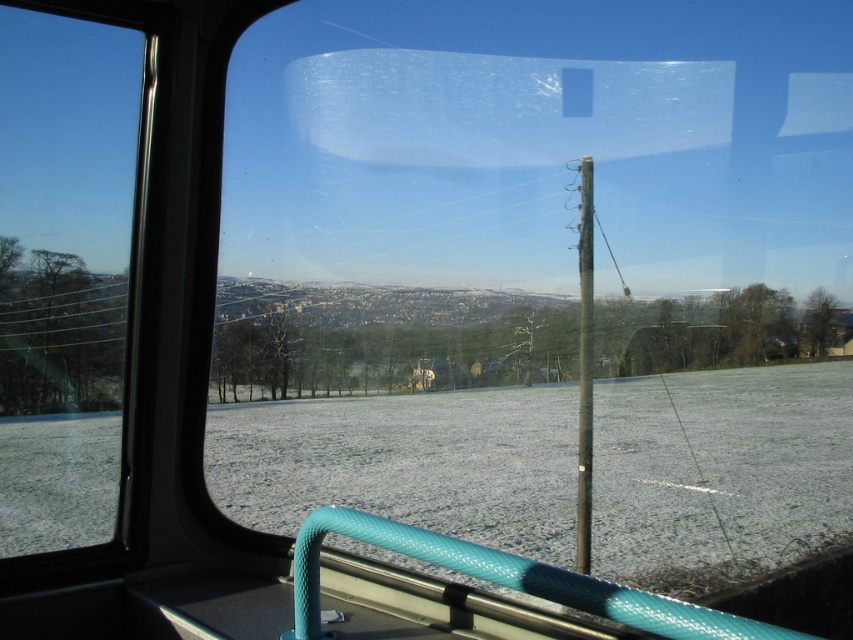
Question: Is transparent glass window at left below metallic pole at center?

Choices:
 (A) yes
 (B) no

Answer: (B)

Question: Which point appears farthest from the camera in this image?

Choices:
 (A) (76, 308)
 (B) (584, 180)

Answer: (A)

Question: Can you confirm if transparent glass window at left is smaller than metallic pole at center?

Choices:
 (A) yes
 (B) no

Answer: (B)

Question: Can you confirm if transparent glass window at left is positioned to the left of metallic pole at center?

Choices:
 (A) no
 (B) yes

Answer: (B)